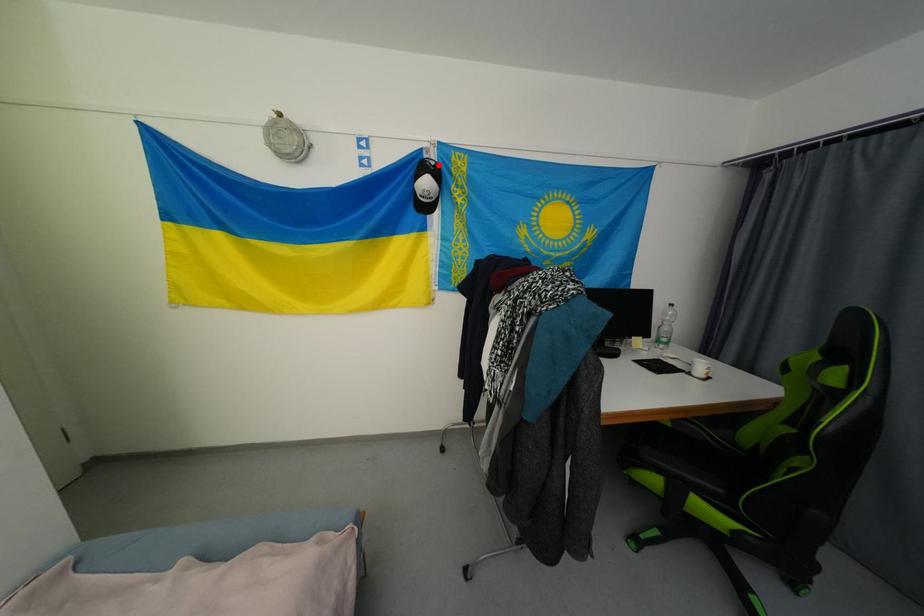
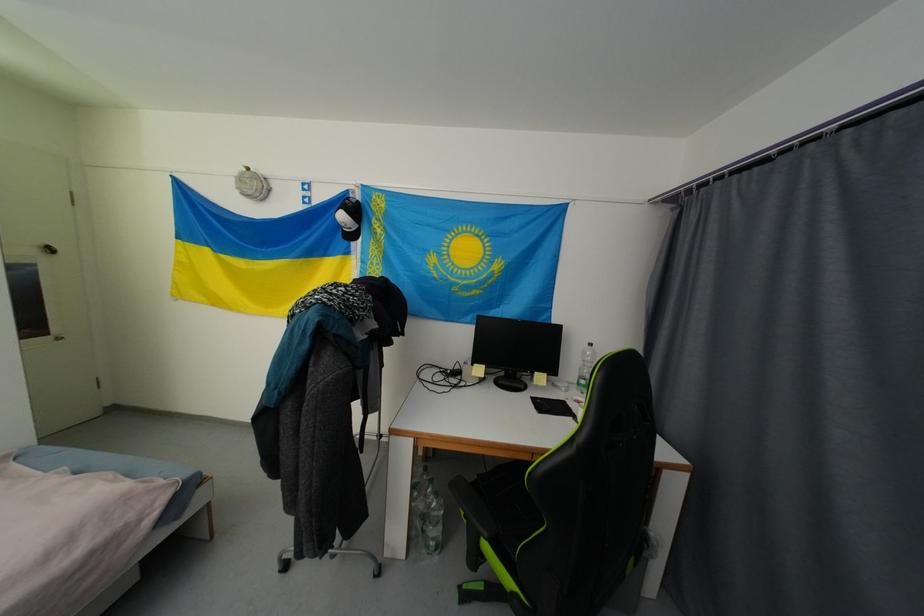
Locate, in the second image, the point that corresponds to the highlighted location in the first image.

(359, 203)